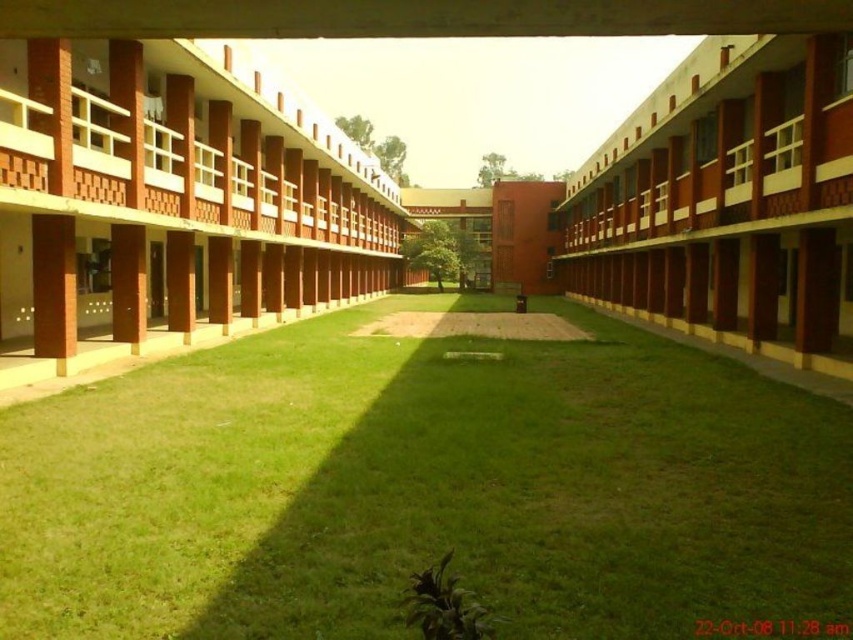
You are standing in the courtyard and want to walk to the point marked as point (x=48, y=403). Which direction should you head to reach it first compared to point (x=672, y=76)?

Point (x=48, y=403) is closer to the camera than point (x=672, y=76), so you should head towards it first as it is nearer.

You are a groundskeeper planning to mow the green grass at center and maintain the matte brick building at center. Which area requires more attention in terms of size? Please explain based on their sizes.

The matte brick building at center requires more attention in terms of size because it is larger than the green grass at center.

You are a student standing in the courtyard and want to take a shortcut to the library entrance located at the base of the matte brick building at left. Since you are carrying a heavy backpack, you need to choose a path that avoids rough terrain. Which direction should you walk towards from the green grass at center to reach the library entrance without stepping on uneven ground?

The green grass at center is located below the matte brick building at left, so walking towards the matte brick building at left from the green grass at center will lead you to the library entrance on paved ground, avoiding the uneven grass.